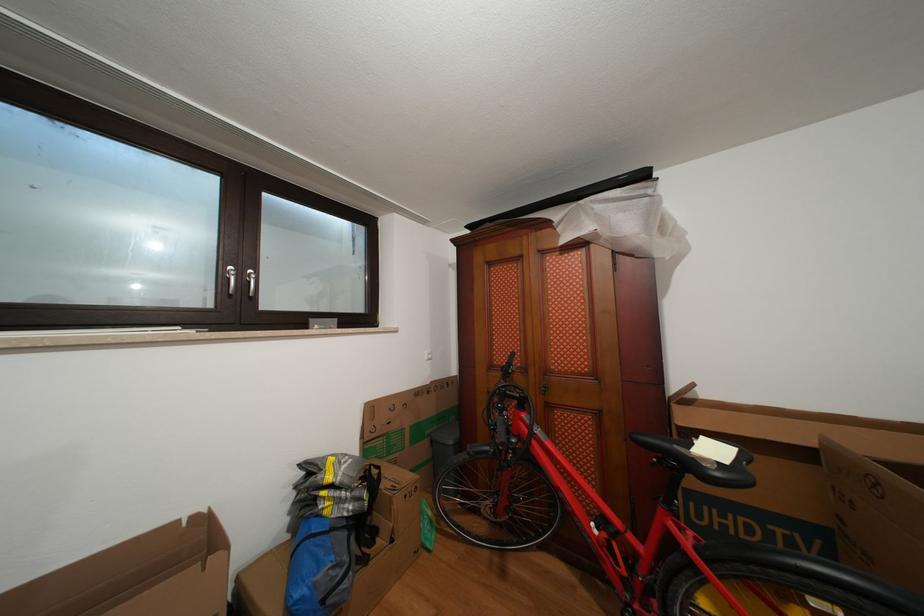
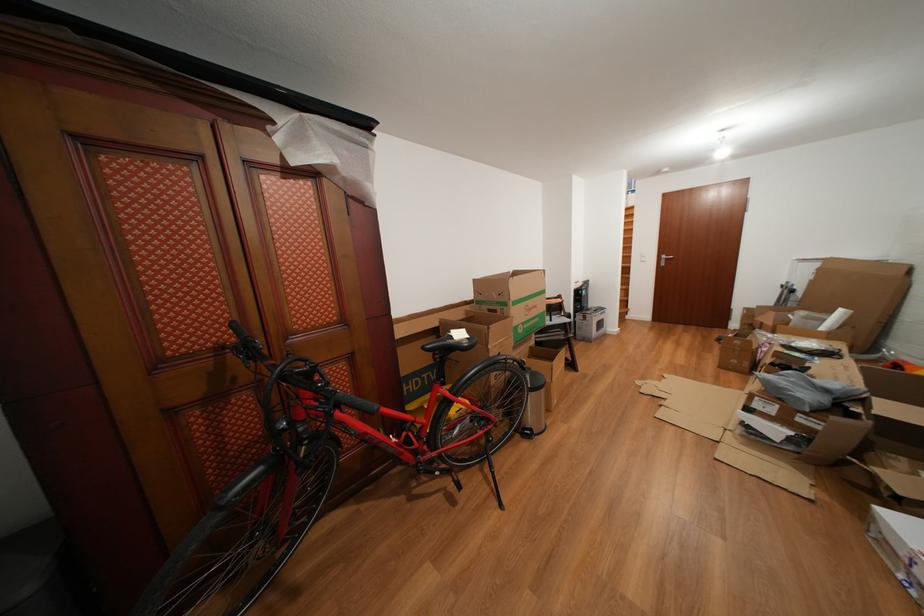
The point at (721, 456) is marked in the first image. Where is the corresponding point in the second image?

(468, 339)